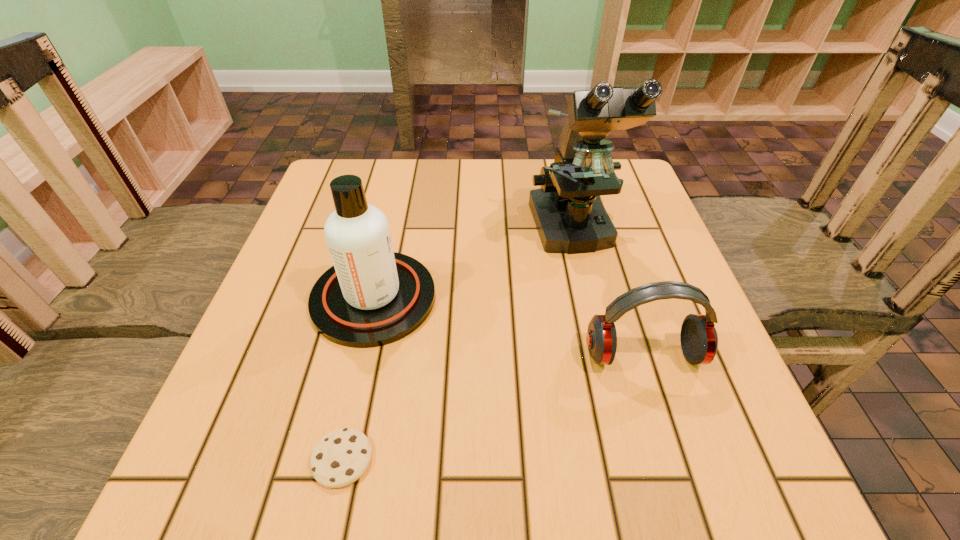
Find the location of a particular element. object located at the near edge is located at coordinates (341, 457).

The image size is (960, 540). Identify the location of object that is at the left edge. (372, 296).

The width and height of the screenshot is (960, 540). I want to click on microscope that is positioned at the right edge, so [570, 218].

I want to click on earphone that is at the right edge, so click(699, 341).

I want to click on object located at the far right corner, so click(x=570, y=218).

I want to click on blank space at the far edge of the desktop, so click(459, 197).

Where is `vacant space at the near edge of the desktop`? Image resolution: width=960 pixels, height=540 pixels. vacant space at the near edge of the desktop is located at coordinates (310, 450).

Identify the location of vacant point at the left edge. Image resolution: width=960 pixels, height=540 pixels. (298, 277).

You are a GUI agent. You are given a task and a screenshot of the screen. Output one action in this format:
    pyautogui.click(x=<x>, y=<y>)
    Task: Click on the vacant space at the right edge of the desktop
    This screenshot has height=540, width=960.
    Given the screenshot: What is the action you would take?
    pyautogui.click(x=662, y=234)

The height and width of the screenshot is (540, 960). What are the coordinates of `vacant region at the far left corner of the desktop` in the screenshot? It's located at (370, 172).